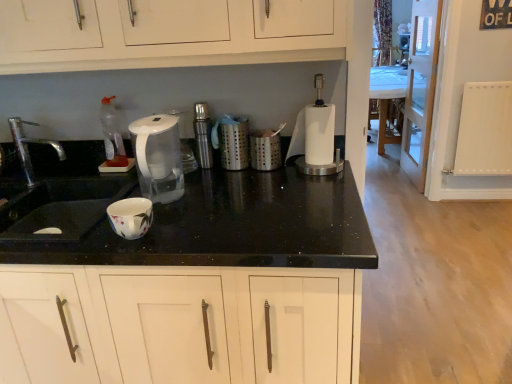
The width and height of the screenshot is (512, 384). What do you see at coordinates (315, 137) in the screenshot?
I see `white plastic blender at center` at bounding box center [315, 137].

What do you see at coordinates (28, 149) in the screenshot? The width and height of the screenshot is (512, 384). I see `silver metallic faucet at left` at bounding box center [28, 149].

Measure the distance between point (198, 108) and camera.

Point (198, 108) and camera are 5.29 feet apart from each other.

At what (x,y) coordinates should I click in order to perform the action: click on satin silver strainer at center. Please return your answer as a coordinate pair (x, y). Looking at the image, I should click on (231, 141).

Considering the positions of objects satin silver strainer at center and transparent plastic kettle at center in the image provided, who is more to the left, satin silver strainer at center or transparent plastic kettle at center?

From the viewer's perspective, transparent plastic kettle at center appears more on the left side.

From the image's perspective, which one is positioned higher, satin silver strainer at center or transparent plastic kettle at center?

satin silver strainer at center is shown above in the image.

Considering their positions, is satin silver strainer at center located in front of or behind transparent plastic kettle at center?

Visually, satin silver strainer at center is located behind transparent plastic kettle at center.

Considering the relative sizes of satin nickel faucet at center and satin silver strainer at center in the image provided, is satin nickel faucet at center shorter than satin silver strainer at center?

No.

Is satin nickel faucet at center far away from satin silver strainer at center?

No, satin nickel faucet at center is in close proximity to satin silver strainer at center.

Which is behind, satin nickel faucet at center or satin silver strainer at center?

satin nickel faucet at center is more distant.

Could you tell me if satin nickel faucet at center is turned towards satin silver strainer at center?

No, satin nickel faucet at center does not turn towards satin silver strainer at center.

Which of these two, white plastic blender at center or satin silver strainer at center, is smaller?

satin silver strainer at center is smaller.

Looking at this image, is white plastic blender at center facing away from satin silver strainer at center?

No, satin silver strainer at center is not at the back of white plastic blender at center.

Between white plastic blender at center and satin silver strainer at center, which one appears on the left side from the viewer's perspective?

Positioned to the left is satin silver strainer at center.

Which object is positioned more to the right, black granite countertop at center or white plastic blender at center?

white plastic blender at center.

Considering the positions of objects black granite countertop at center and white plastic blender at center in the image provided, who is behind, black granite countertop at center or white plastic blender at center?

white plastic blender at center.

From the image's perspective, is black granite countertop at center positioned above or below white plastic blender at center?

black granite countertop at center is situated lower than white plastic blender at center in the image.

Is black granite countertop at center oriented away from white plastic blender at center?

No.

How different are the orientations of white glossy table at center and satin silver strainer at center in degrees?

There is a 90.7-degree angle between the facing directions of white glossy table at center and satin silver strainer at center.

Based on the photo, can you see white glossy table at center touching satin silver strainer at center?

white glossy table at center is not next to satin silver strainer at center, and they're not touching.

In the image, is white glossy table at center positioned in front of or behind satin silver strainer at center?

Clearly, white glossy table at center is behind satin silver strainer at center.

From the image's perspective, would you say white glossy table at center is positioned over satin silver strainer at center?

Yes, from the image's perspective, white glossy table at center is above satin silver strainer at center.

In the scene shown: Is silver metallic faucet at left not within satin nickel faucet at center?

Absolutely, silver metallic faucet at left is external to satin nickel faucet at center.

In the image, is silver metallic faucet at left positioned in front of or behind satin nickel faucet at center?

Visually, silver metallic faucet at left is located in front of satin nickel faucet at center.

From the image's perspective, who appears lower, silver metallic faucet at left or satin nickel faucet at center?

From the image's view, silver metallic faucet at left is below.

Could you tell me if silver metallic faucet at left is facing satin nickel faucet at center?

No, silver metallic faucet at left is not turned towards satin nickel faucet at center.

Visually, is silver metallic faucet at left positioned to the left or to the right of black granite countertop at center?

Clearly, silver metallic faucet at left is on the left of black granite countertop at center in the image.

Considering the sizes of objects silver metallic faucet at left and black granite countertop at center in the image provided, who is shorter, silver metallic faucet at left or black granite countertop at center?

With less height is silver metallic faucet at left.

Can black granite countertop at center be found inside silver metallic faucet at left?

No, black granite countertop at center is not surrounded by silver metallic faucet at left.

Which is closer, (x=24, y=148) or (x=334, y=366)?

Clearly, point (x=24, y=148) is more distant from the camera than point (x=334, y=366).

The width and height of the screenshot is (512, 384). I want to click on home appliance in front of the satin silver strainer at center, so click(158, 157).

I want to click on kitchen appliance below the satin nickel faucet at center (from a real-world perspective), so click(x=231, y=141).

From the picture: From the image, which object appears to be farther from silver metallic faucet at left, white plastic blender at center or satin nickel faucet at center?

The object further to silver metallic faucet at left is white plastic blender at center.

From the image, which object appears to be farther from silver metallic faucet at left, satin silver strainer at center or white glossy table at center?

white glossy table at center lies further to silver metallic faucet at left than the other object.

Looking at the image, which one is located further to white plastic blender at center, satin silver strainer at center or transparent plastic kettle at center?

transparent plastic kettle at center is positioned further to the anchor white plastic blender at center.

Based on the photo, looking at the image, which one is located further to transparent plastic kettle at center, silver metallic faucet at left or black granite countertop at center?

silver metallic faucet at left lies further to transparent plastic kettle at center than the other object.

Looking at this image, when comparing their distances from satin nickel faucet at center, does black granite countertop at center or transparent plastic kettle at center seem closer?

Based on the image, transparent plastic kettle at center appears to be nearer to satin nickel faucet at center.

Estimate the real-world distances between objects in this image. Which object is further from white glossy table at center, white plastic blender at center or black granite countertop at center?

Based on the image, black granite countertop at center appears to be further to white glossy table at center.

Based on their spatial positions, is silver metallic faucet at left or white glossy table at center further from transparent plastic kettle at center?

Among the two, white glossy table at center is located further to transparent plastic kettle at center.

Looking at the image, which one is located further to white plastic blender at center, black granite countertop at center or transparent plastic kettle at center?

The object further to white plastic blender at center is black granite countertop at center.

Find the location of `kitchen appliance located between satin nickel faucet at center and white plastic blender at center in the left-right direction`. kitchen appliance located between satin nickel faucet at center and white plastic blender at center in the left-right direction is located at coordinates (231, 141).

Identify the location of kitchen appliance between silver metallic faucet at left and white plastic blender at center from left to right. (231, 141).

Identify the location of tap that lies between satin nickel faucet at center and black granite countertop at center from top to bottom. The image size is (512, 384). (28, 149).

Identify the location of appliance positioned between satin silver strainer at center and white glossy table at center from near to far. This screenshot has height=384, width=512. (203, 135).